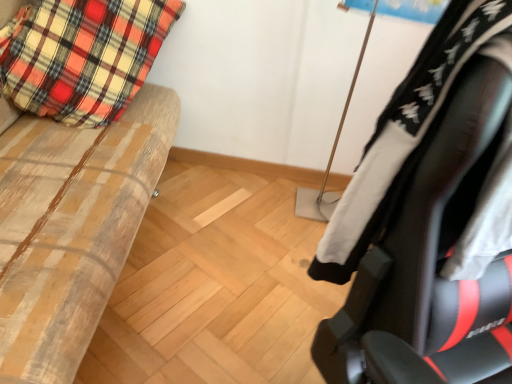
Question: Relative to black leather chair at right, is plaid fabric pillow at left in front or behind?

Choices:
 (A) behind
 (B) front

Answer: (A)

Question: Is plaid fabric pillow at left inside the boundaries of black leather chair at right, or outside?

Choices:
 (A) outside
 (B) inside

Answer: (A)

Question: Which object is the closest to the wooden bench at left?

Choices:
 (A) black leather chair at right
 (B) plaid fabric pillow at left

Answer: (B)

Question: Which of these objects is positioned closest to the plaid fabric pillow at left?

Choices:
 (A) wooden bench at left
 (B) black leather chair at right

Answer: (A)